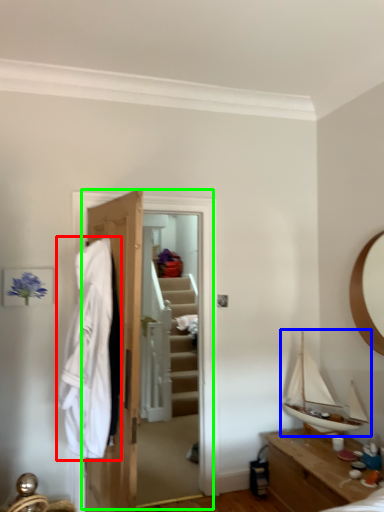
Question: Considering the real-world distances, which object is farthest from clothing (highlighted by a red box)? boat (highlighted by a blue box) or closet (highlighted by a green box)?

Choices:
 (A) boat
 (B) closet

Answer: (A)